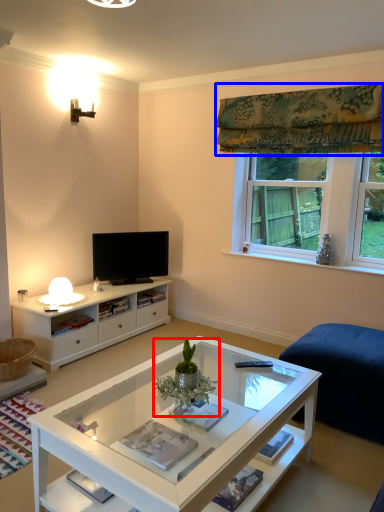
Question: Which object appears closest to the camera in this image, houseplant (highlighted by a red box) or curtain (highlighted by a blue box)?

Choices:
 (A) houseplant
 (B) curtain

Answer: (A)